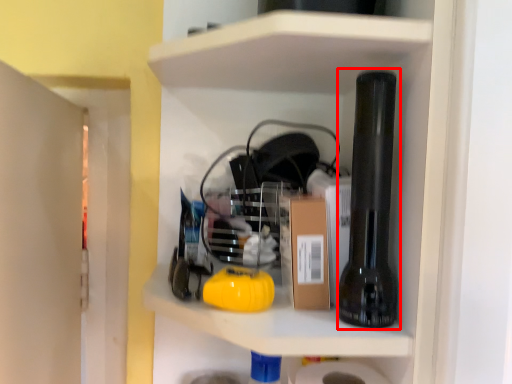
Question: From the image, what is the correct spatial relationship of beer bottle (annotated by the red box) in relation to cardboard box?

Choices:
 (A) right
 (B) left

Answer: (A)